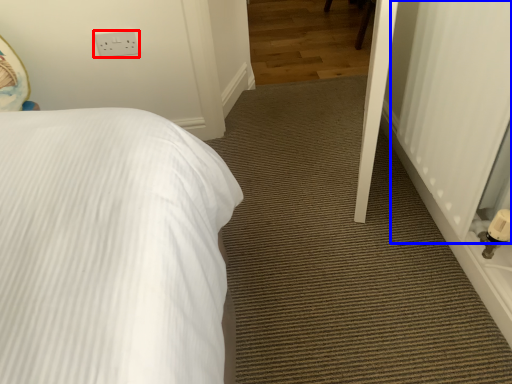
Question: Which point is closer to the camera, electric outlet (highlighted by a red box) or screen door (highlighted by a blue box)?

Choices:
 (A) electric outlet
 (B) screen door

Answer: (B)